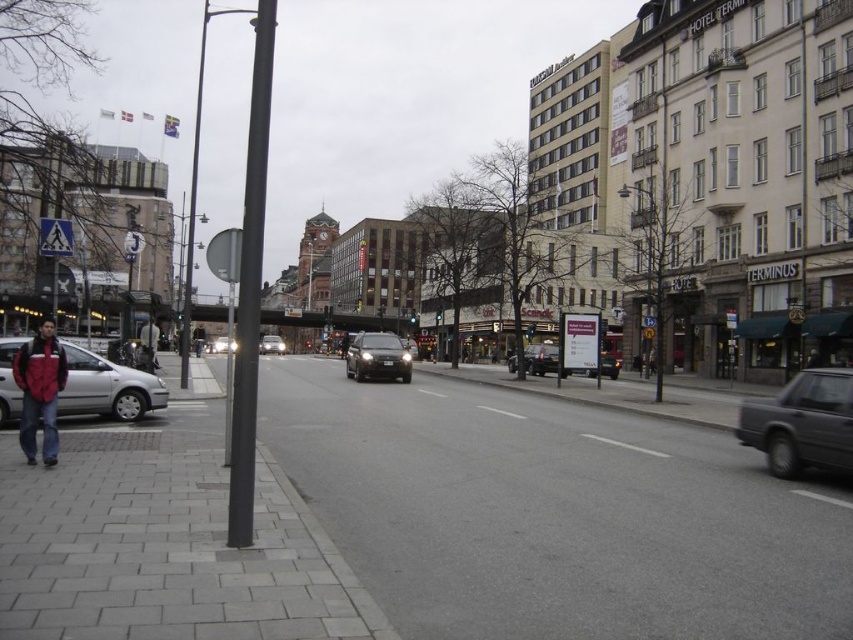
You are a pedestrian waiting to cross the street. You see the dark gray metallic car at right and the red jacket at lower left. Which object is positioned lower in the image?

The dark gray metallic car at right is located below the red jacket at lower left, so it is positioned lower in the image.

You are a delivery person standing on the sidewalk near the red jacket at lower left. You need to cross the street to deliver a package to the HOTEL TERMINUS building. Is the dark gray metallic car at right blocking your path? Please explain your reasoning.

The dark gray metallic car at right has a larger size compared to the red jacket at lower left, but the question is about blocking the path. Since the car is at the right and the pedestrian is at the lower left near the crosswalk, the car may not necessarily block the path unless it is directly in the way. However, the description does not mention the car being in motion or positioned across the crosswalk. Therefore, the path might still be clear unless the car is actively blocking it.

You are a delivery person with a 1.2 meter wide cart. You need to deliver a package to a store located between the white plastic pedestrian crossing sign at left and the HOTEL TERMINUS building. Can your cart fit through the space between them?

The distance between the white plastic pedestrian crossing sign at left and the HOTEL TERMINUS building is 16.30 meters. Since your cart is only 1.2 meters wide, it can easily fit through the space between them as the distance is much wider than the cart.